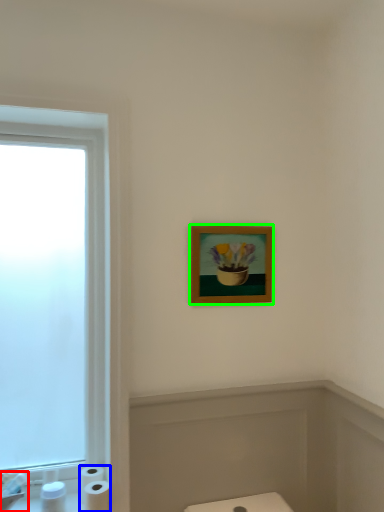
Question: Which is farther away from sink (highlighted by a red box)? toilet paper (highlighted by a blue box) or picture frame (highlighted by a green box)?

Choices:
 (A) toilet paper
 (B) picture frame

Answer: (B)